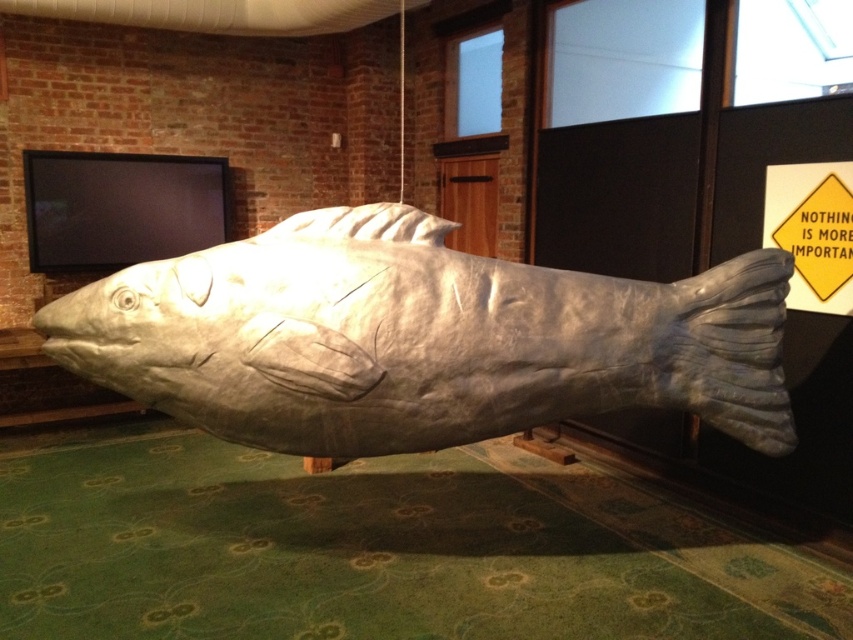
You are an interior designer assessing the space. The client wants to know if the metallic fish at center and the yellow paper sign at upper right are proportionally balanced. Based on their sizes, what would you advise?

The metallic fish at center is larger in size than the yellow paper sign at upper right, so they are not proportionally balanced. The yellow paper sign at upper right may appear too small compared to the metallic fish at center.

You are an interior designer assessing the space. The metallic fish at center and the yellow paper sign at upper right are both in the room. Which object is taller?

The metallic fish at center is taller than the yellow paper sign at upper right.

You are an interior designer planning to add a new painting to the wall between the metallic fish at center and the yellow paper sign at upper right. Where should you place it to ensure it is centered between them?

The metallic fish at center is positioned on the left side of the yellow paper sign at upper right, so placing the new painting between them would require positioning it halfway between the two objects along the horizontal axis.